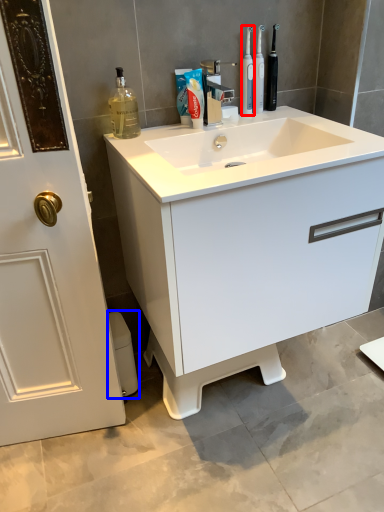
Question: Which object appears farthest to the camera in this image, mouthwash (highlighted by a red box) or toilet bowl (highlighted by a blue box)?

Choices:
 (A) mouthwash
 (B) toilet bowl

Answer: (B)